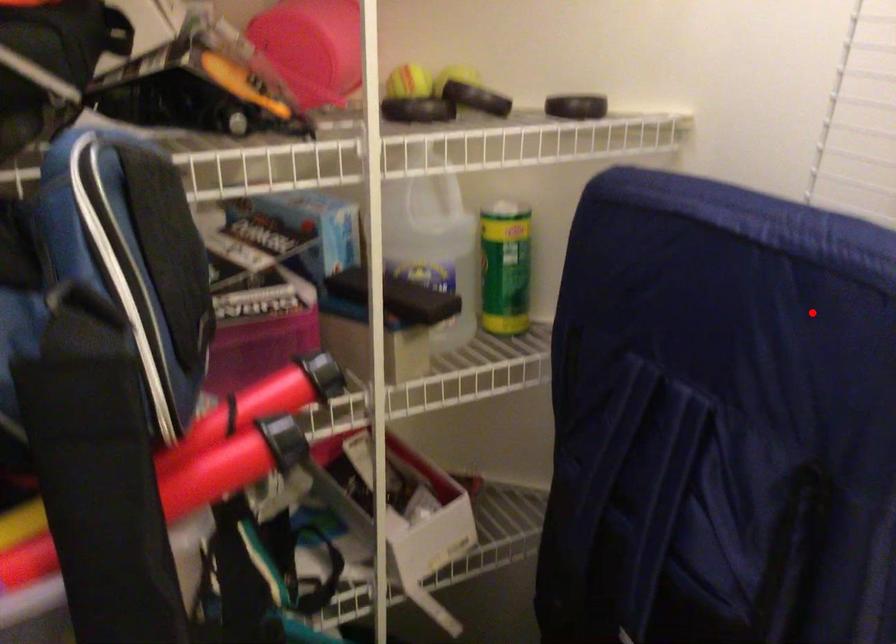
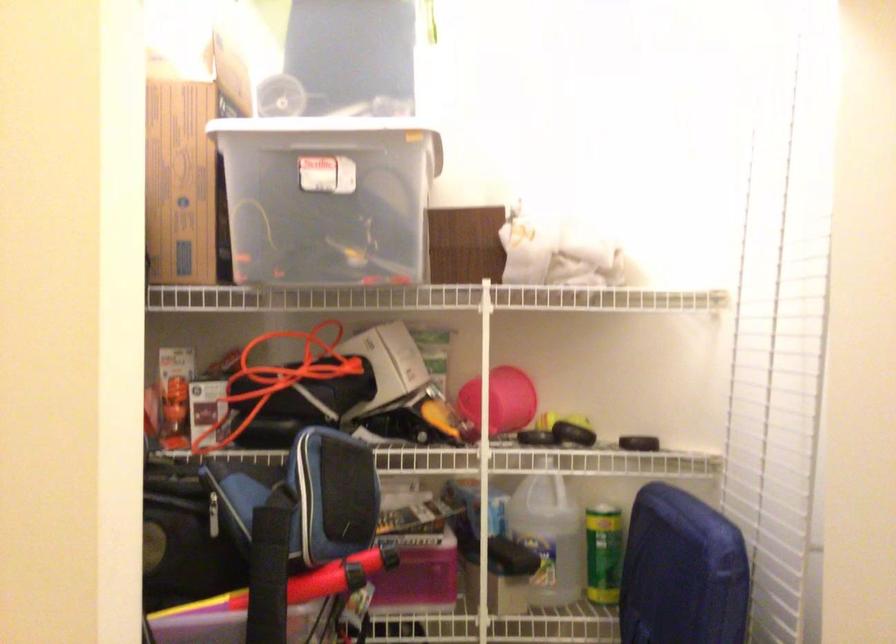
Question: A red point is marked in image1. In image2, is the corresponding 3D point closer to the camera or farther? Reply with the corresponding letter.

Choices:
 (A) The corresponding 3D point is closer.
 (B) The corresponding 3D point is farther.

Answer: (B)